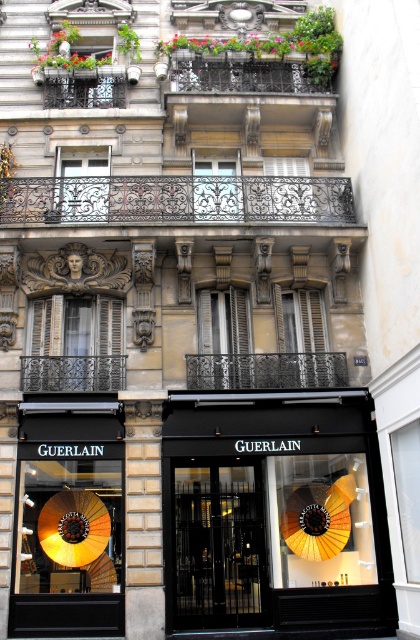
Question: Considering the relative positions of black glass door at center and shiny gold umbrella at lower left in the image provided, where is black glass door at center located with respect to shiny gold umbrella at lower left?

Choices:
 (A) right
 (B) left

Answer: (A)

Question: Does matte black entrance at center appear over black glass door at center?

Choices:
 (A) no
 (B) yes

Answer: (B)

Question: Which object appears closest to the camera in this image?

Choices:
 (A) black glass door at center
 (B) matte black entrance at center
 (C) shiny gold umbrella at lower left

Answer: (B)

Question: Which is farther from the black glass door at center?

Choices:
 (A) shiny gold umbrella at lower left
 (B) matte black entrance at center

Answer: (A)

Question: Which of the following is the closest to the observer?

Choices:
 (A) (196, 561)
 (B) (391, 595)

Answer: (B)

Question: Can you confirm if black glass door at center is positioned above shiny gold umbrella at lower left?

Choices:
 (A) no
 (B) yes

Answer: (B)